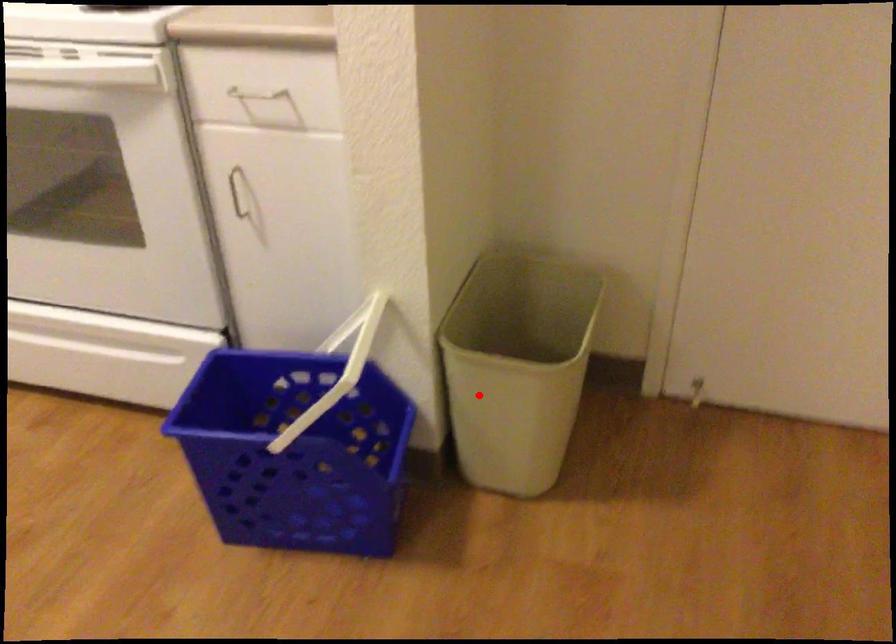
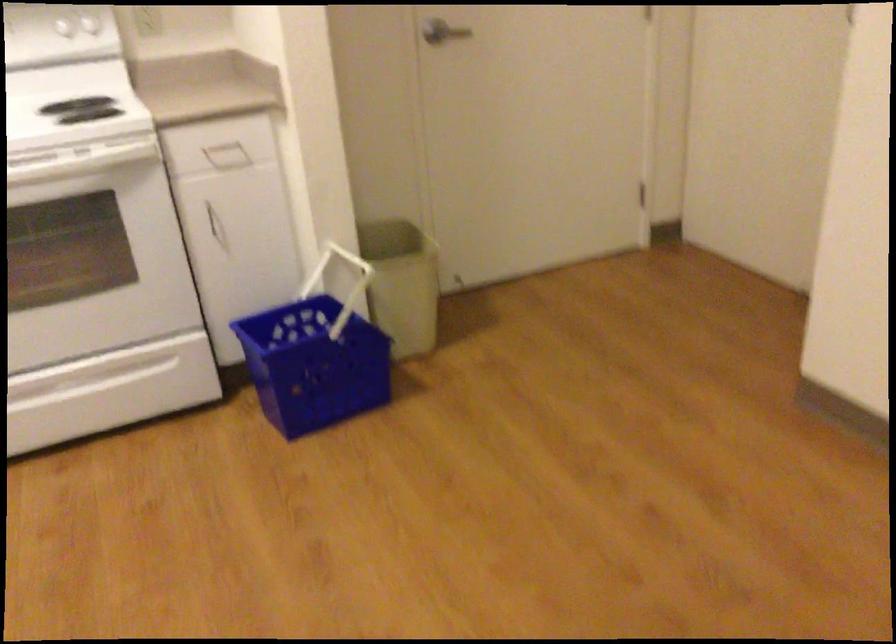
Question: I am providing you with two images of the same scene from different viewpoints. A red point is shown in image1. For the corresponding object point in image2, is it positioned nearer or farther from the camera?

Choices:
 (A) Nearer
 (B) Farther

Answer: (B)